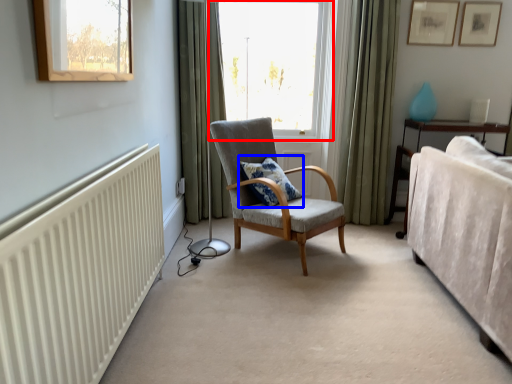
Question: Among these objects, which one is nearest to the camera, window (highlighted by a red box) or pillow (highlighted by a blue box)?

Choices:
 (A) window
 (B) pillow

Answer: (B)